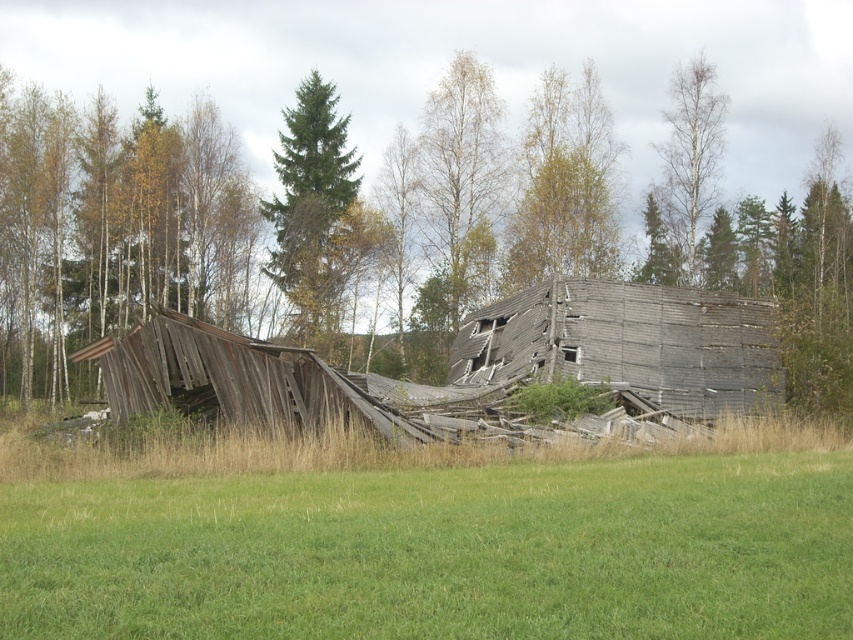
Is green coniferous tree at center to the right of bare birch tree at upper right from the viewer's perspective?

In fact, green coniferous tree at center is to the left of bare birch tree at upper right.

Consider the image. Can you confirm if green coniferous tree at center is positioned below bare birch tree at upper right?

Correct, green coniferous tree at center is located below bare birch tree at upper right.

Find the location of `green coniferous tree at center`. green coniferous tree at center is located at coordinates (312, 204).

The width and height of the screenshot is (853, 640). What are the coordinates of `green coniferous tree at center` in the screenshot? It's located at (312, 204).

Does point (12, 125) come farther from viewer compared to point (305, 193)?

No, (12, 125) is closer to viewer.

Which is behind, point (520, 177) or point (306, 170)?

The point (520, 177) is behind.

Where is `weathered wood structure at center`? Image resolution: width=853 pixels, height=640 pixels. weathered wood structure at center is located at coordinates pyautogui.click(x=292, y=221).

Does weathered wood hut at center have a lesser height compared to green coniferous tree at center?

Indeed, weathered wood hut at center has a lesser height compared to green coniferous tree at center.

Is weathered wood hut at center thinner than green coniferous tree at center?

Yes, weathered wood hut at center is thinner than green coniferous tree at center.

Which is behind, point (112, 376) or point (314, 314)?

Point (314, 314)

The width and height of the screenshot is (853, 640). In order to click on weathered wood hut at center in this screenshot , I will do `click(230, 380)`.